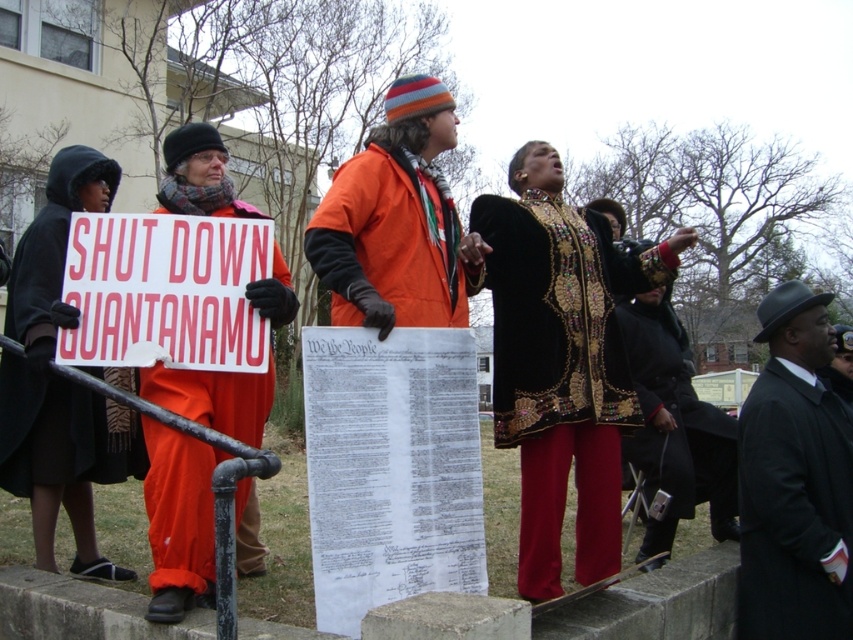
Based on the photo, looking at the protest scene, where is the black wool hat at upper right in relation to the orange fabric sign at left?

The black wool hat at upper right is located to the right of the orange fabric sign at left.

You are a photographer at the protest scene. You want to take a photo that includes both the black wool hat at upper right and the orange fabric sign at left. Which object should you focus on first to ensure both are in sharp focus?

The black wool hat at upper right is closer to you than the orange fabric sign at left. To ensure both are in sharp focus, you should focus on the black wool hat at upper right first, as it is the closer object.